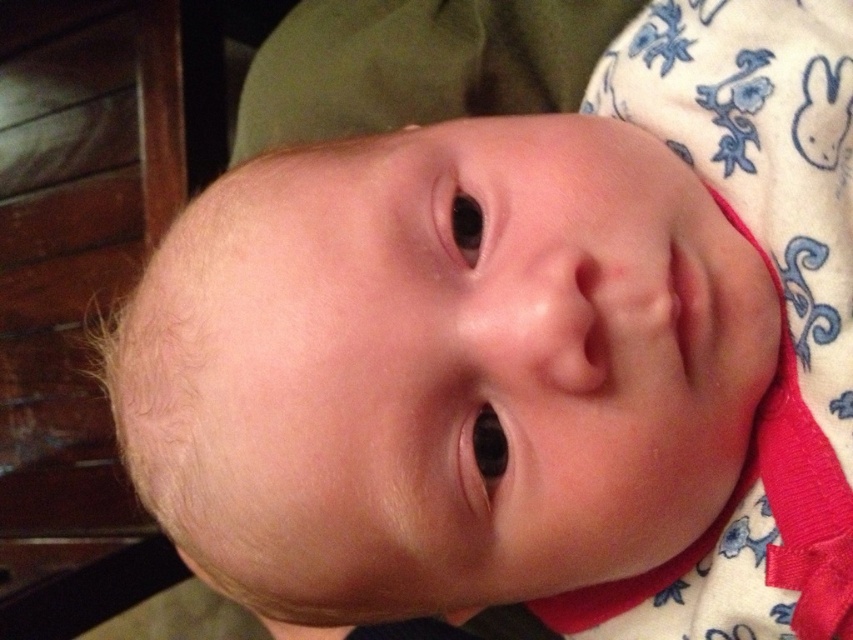
Question: Can you confirm if white floral fabric at right is positioned below transparent skin at center?

Choices:
 (A) yes
 (B) no

Answer: (B)

Question: Observing the image, what is the correct spatial positioning of pink smooth skin at center in reference to transparent skin at center?

Choices:
 (A) below
 (B) above

Answer: (B)

Question: Is pink smooth skin at center below transparent skin at center?

Choices:
 (A) no
 (B) yes

Answer: (A)

Question: Which is farther from the transparent skin at center?

Choices:
 (A) white floral fabric at right
 (B) pink smooth skin at center

Answer: (A)

Question: Considering the real-world distances, which object is closest to the pink smooth skin at center?

Choices:
 (A) transparent skin at center
 (B) white floral fabric at right

Answer: (A)

Question: Which point is farther from the camera taking this photo?

Choices:
 (A) (480, 465)
 (B) (692, 161)

Answer: (B)